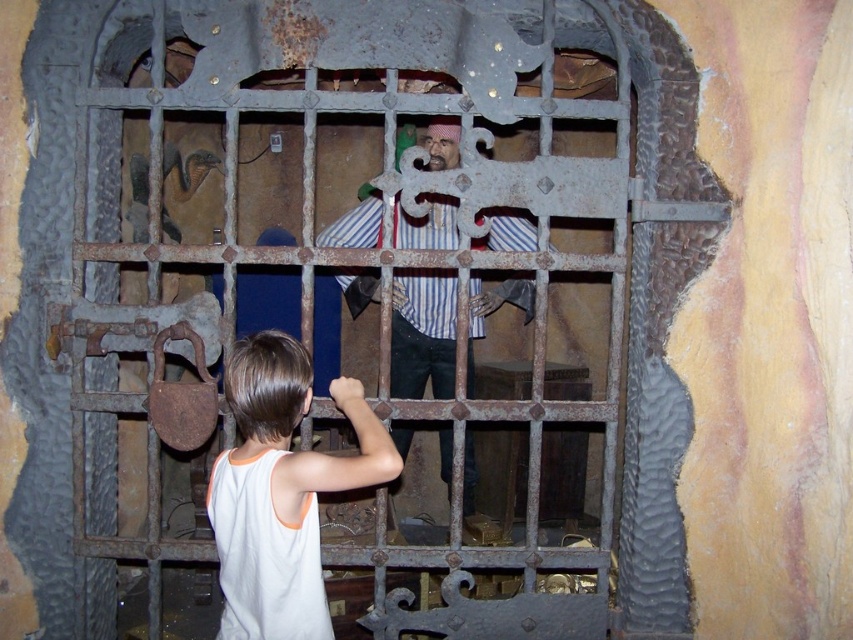
Question: Is white cotton tank top at lower left wider than striped fabric pirate at center?

Choices:
 (A) no
 (B) yes

Answer: (A)

Question: Is white cotton tank top at lower left thinner than striped fabric pirate at center?

Choices:
 (A) yes
 (B) no

Answer: (A)

Question: Which point is farther from the camera taking this photo?

Choices:
 (A) (x=257, y=593)
 (B) (x=437, y=224)

Answer: (B)

Question: Does white cotton tank top at lower left appear on the left side of striped fabric pirate at center?

Choices:
 (A) no
 (B) yes

Answer: (B)

Question: Among these points, which one is nearest to the camera?

Choices:
 (A) (285, 566)
 (B) (397, 246)

Answer: (A)